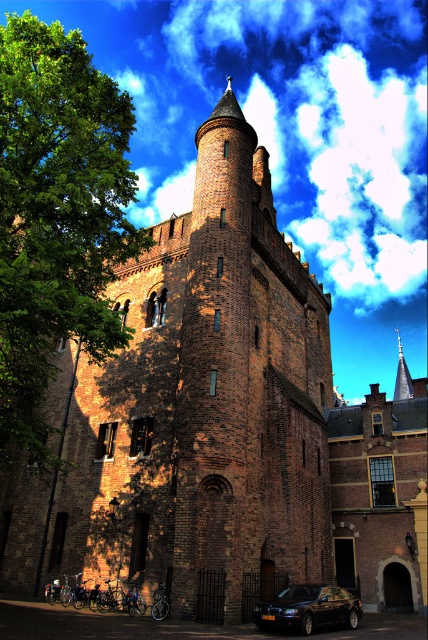
Who is taller, green leafy tree at left or shiny black car at lower center?

green leafy tree at left

Is green leafy tree at left wider than shiny black car at lower center?

Yes, green leafy tree at left is wider than shiny black car at lower center.

I want to click on green leafy tree at left, so click(56, 218).